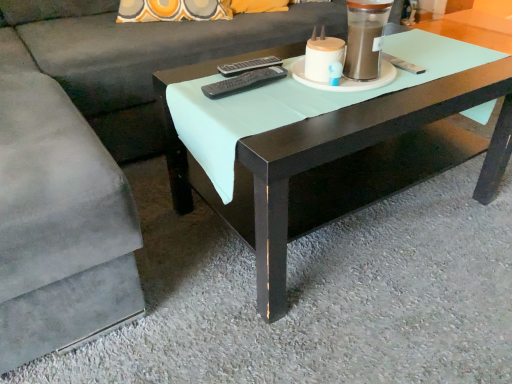
Identify the location of free space in front of matte white candle holder at upper center. (360, 103).